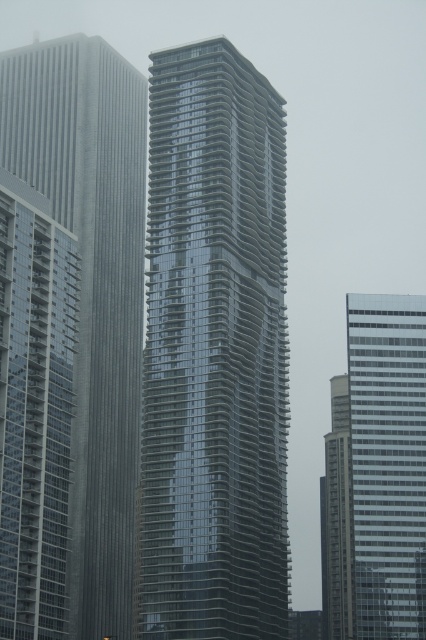
Can you confirm if glossy glass tower at center is positioned to the left of reflective glass skyscraper at left?

No, glossy glass tower at center is not to the left of reflective glass skyscraper at left.

Can you confirm if glossy glass tower at center is bigger than reflective glass skyscraper at left?

No, glossy glass tower at center is not bigger than reflective glass skyscraper at left.

Between point (238, 413) and point (118, 627), which one is positioned in front?

Point (238, 413) is more forward.

At what (x,y) coordinates should I click in order to perform the action: click on glossy glass tower at center. Please return your answer as a coordinate pair (x, y). Image resolution: width=426 pixels, height=640 pixels. Looking at the image, I should click on (213, 353).

What do you see at coordinates (213, 353) in the screenshot? This screenshot has width=426, height=640. I see `glossy glass tower at center` at bounding box center [213, 353].

Does glossy glass tower at center lie in front of glassy reflective skyscraper at right?

Yes.

Where is `glossy glass tower at center`? glossy glass tower at center is located at coordinates (213, 353).

This screenshot has width=426, height=640. In order to click on glossy glass tower at center in this screenshot , I will do `click(213, 353)`.

Who is positioned more to the right, clear glass skyscraper at right or glassy reflective skyscraper at right?

glassy reflective skyscraper at right is more to the right.

Who is higher up, clear glass skyscraper at right or glassy reflective skyscraper at right?

Positioned higher is clear glass skyscraper at right.

Which is behind, point (400, 636) or point (336, 445)?

Positioned behind is point (336, 445).

Locate an element on the screen. This screenshot has width=426, height=640. clear glass skyscraper at right is located at coordinates (388, 461).